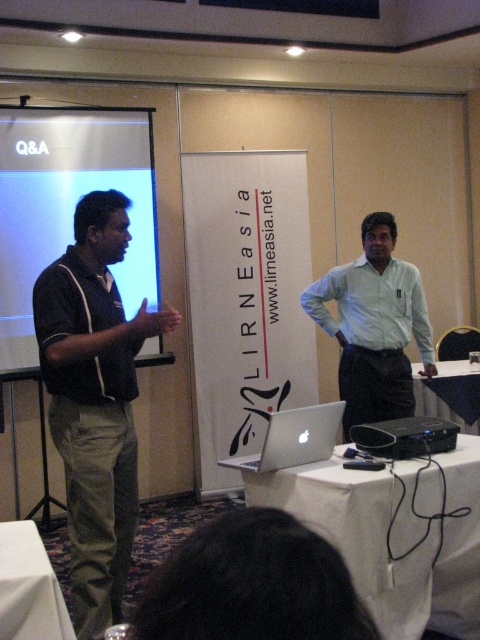
Question: Which point is closer to the camera?

Choices:
 (A) white fabric table at center
 (B) light blue shirt at center
 (C) dark green shirt at left

Answer: (C)

Question: Observing the image, what is the correct spatial positioning of white cloth-covered table at center in reference to silver metallic laptop at center?

Choices:
 (A) above
 (B) below

Answer: (B)

Question: Which object is closer to the camera taking this photo?

Choices:
 (A) dark green shirt at left
 (B) white cloth-covered table at center
 (C) light blue shirt at center
 (D) white glossy projection screen at upper left

Answer: (A)

Question: Estimate the real-world distances between objects in this image. Which object is farther from the light blue shirt at center?

Choices:
 (A) white glossy projection screen at upper left
 (B) white cloth-covered table at center
 (C) silver metallic laptop at center
 (D) black plastic projector at center

Answer: (A)

Question: Is white glossy projection screen at upper left below silver metallic laptop at center?

Choices:
 (A) yes
 (B) no

Answer: (B)

Question: Observing the image, what is the correct spatial positioning of white cloth-covered table at center in reference to silver metallic laptop at center?

Choices:
 (A) right
 (B) left

Answer: (A)